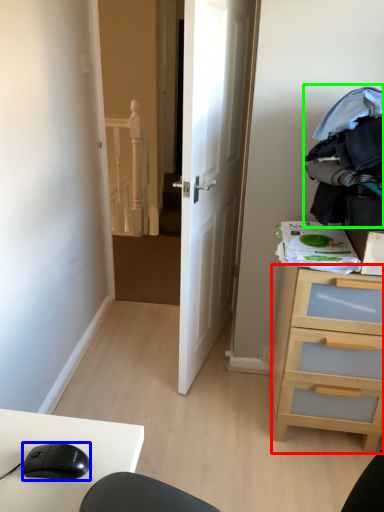
Question: Which object is positioned closest to chest of drawers (highlighted by a red box)? Select from mouse (highlighted by a blue box) and clothing (highlighted by a green box).

Choices:
 (A) mouse
 (B) clothing

Answer: (B)